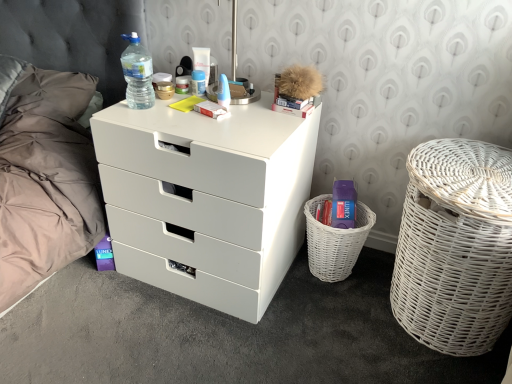
Locate an element on the screen. The image size is (512, 384). vacant area that is in front of white matte chest of drawers at center is located at coordinates (185, 336).